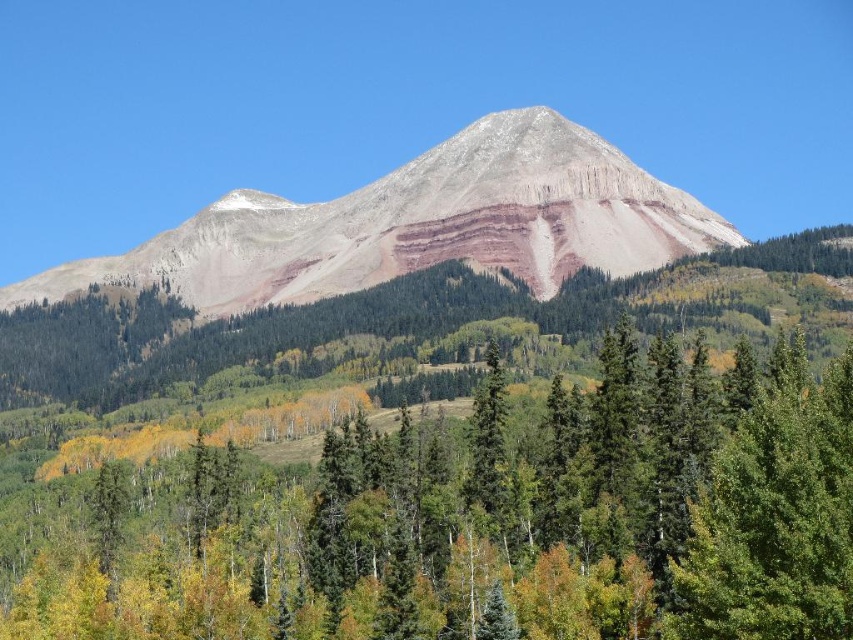
You are a hiker standing at the base of the rustic rock mountain at center and looking towards the green matte tree at center. Which object is closer to you?

The green matte tree at center is closer to you because it is positioned under the rustic rock mountain at center, meaning it lies between you and the mountain.

You are planning to set up a tent for camping. You have two options for the campsite location near the green matte tree at center and the rustic rock mountain at center. Which location would provide more space for your tent and equipment?

The rustic rock mountain at center provides more space for your tent and equipment since the green matte tree at center occupies less space than the rustic rock mountain at center.